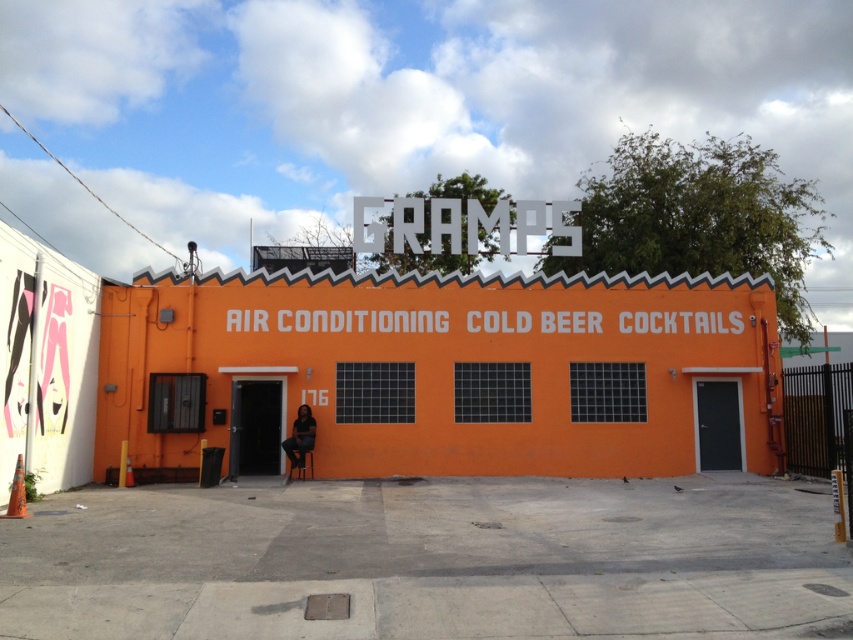
You are a customer standing outside the building and want to read the white plastic sign at upper center. Is the matte black chair at center blocking your view of the sign?

The matte black chair at center is behind the white plastic sign at upper center, so it is not blocking your view. You can see the sign clearly.

You are a delivery person who needs to deliver a package to the building. The package is too large to fit through the door on the right. Can you place it on the white plastic sign at upper center instead of the matte black chair at center?

The white plastic sign at upper center is bigger than the matte black chair at center, so yes, the package can be placed on the white plastic sign at upper center instead of the matte black chair at center because it has a larger surface area.